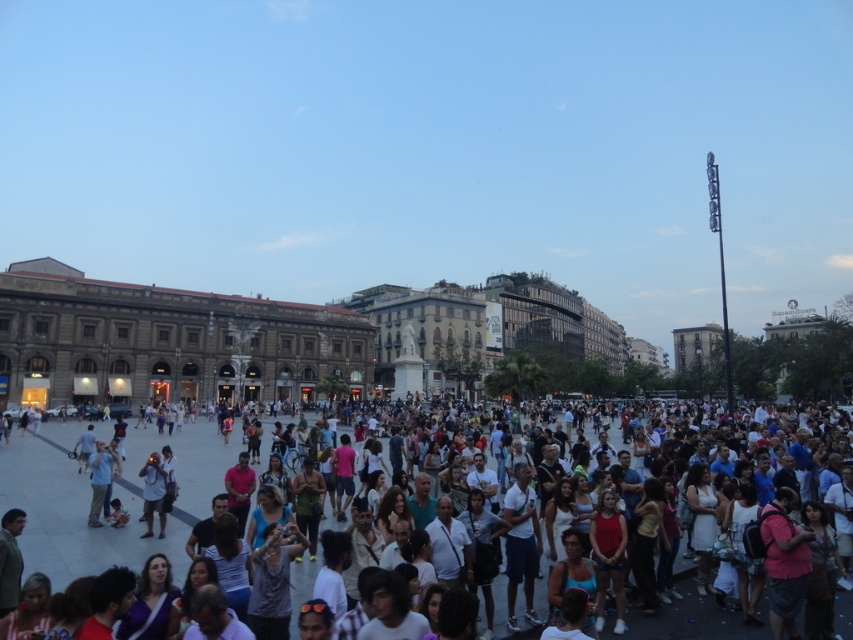
In the scene shown: You are standing at point (134,449) in the public square. You want to take a photo of the camera in the crowd. Is the camera within your phone camera lens range of 50 meters?

The point (134,449) and camera are 73.74 meters apart from each other. Since the distance exceeds the 50 meters range, the camera is out of your phone camera lens range.

Looking at this image, you are standing in the public square and notice two people wearing shirts. One is wearing a white cotton shirt at center and the other a light blue cotton shirt at lower left. Which person appears taller from your vantage point?

The white cotton shirt at center is much taller as light blue cotton shirt at lower left, so the person wearing the white cotton shirt at center appears taller.

You are standing in the public square and want to take a photo of both the white cotton shirt at center and the light blue cotton shirt at lower left. Which shirt should you focus on first to ensure both are in clear view?

You should focus on the white cotton shirt at center first because it is closer to you than the light blue cotton shirt at lower left, ensuring both are in clear view when focused properly.